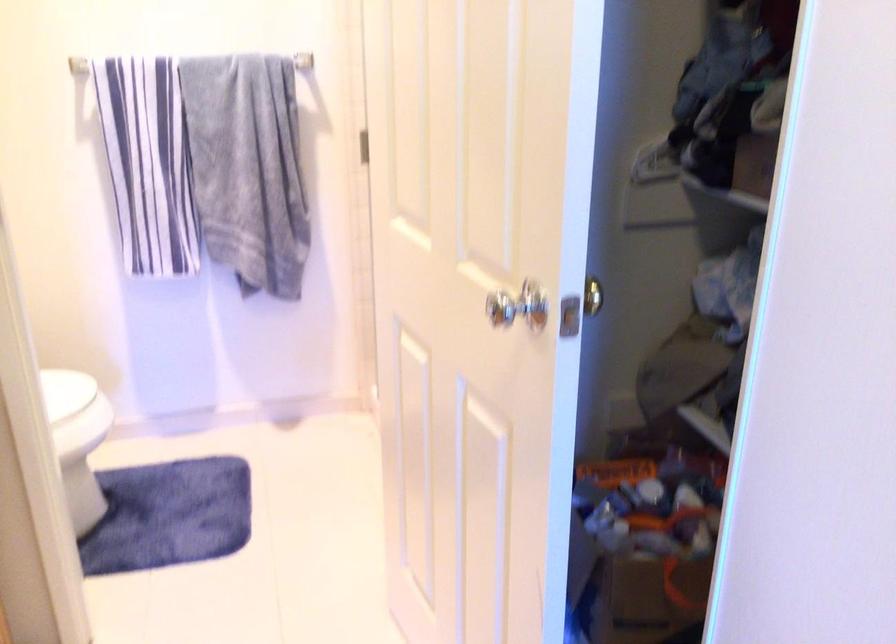
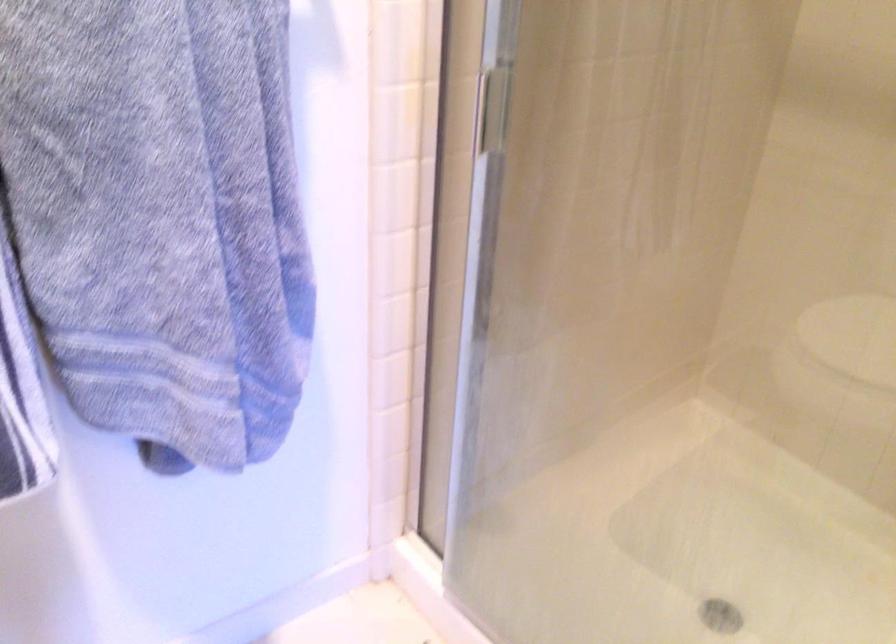
In a continuous first-person perspective shot, in which direction is the camera moving?

The cameraman walked toward left, forward.